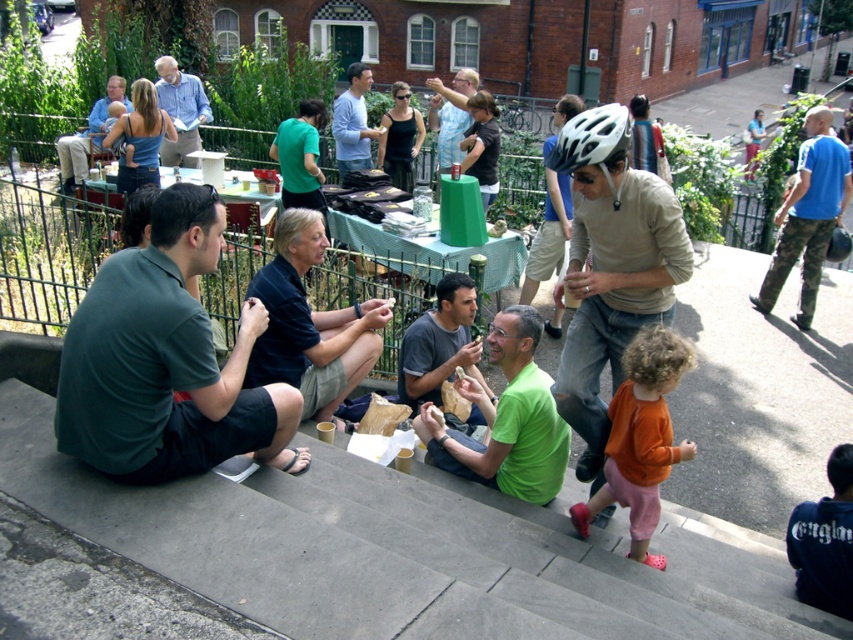
You are a photographer taking a picture of the light blue shirt at center and the matte blue shirt at center. Which shirt should you focus on first if you want to capture both in the frame without moving the camera?

The light blue shirt at center has a lesser height compared to matte blue shirt at center, so you should focus on the matte blue shirt at center first since it is taller and might be more prominent in the frame.

You are a photographer trying to capture a candid shot of the dark blue cotton shirt at center without the matte beige helmet at center blocking the view. Is this possible given their positions?

The matte beige helmet at center is located above the dark blue cotton shirt at center, so it would block the view of the shirt. To capture the shirt without the helmet blocking, you would need to adjust your angle or position to avoid the helmet above.

You are a photographer trying to capture a candid shot of the light blue shirt at upper center without including the matte beige helmet at center in the frame. Based on their positions, is this possible?

The matte beige helmet at center is positioned under the light blue shirt at upper center, so the helmet is directly below the shirt. To avoid including the helmet in the shot, you would need to angle the camera upward to focus solely on the shirt, as the helmet is located beneath it.